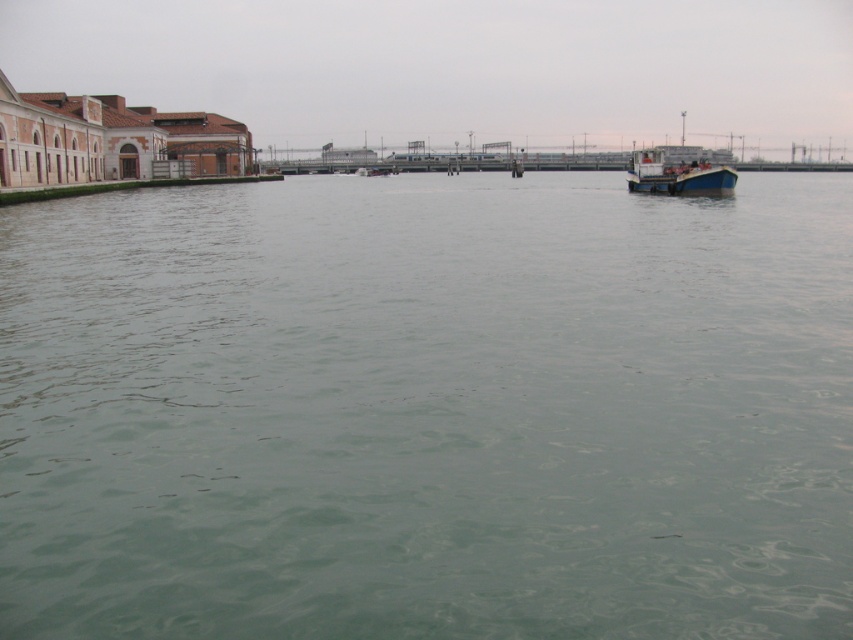
You are a tourist standing on the dock and want to take a photo of the wooden boat at right. To get the best reflection of the boat in the green water at center, where should you position yourself relative to the boat?

You should position yourself in front of the wooden boat at right, closer to the green water at center, since the green water at center is in front of the wooden boat at right and can reflect the boat better from that angle.

You are standing at the edge of the waterway and notice a point marked at coordinates (428, 410). According to the scene description, what is the color of the surface at that point?

The point at coordinates (428, 410) corresponds to green water at center, so the surface color there is green.

Based on the photo, you are standing on the wooden boat at right and want to observe the green water at center. In which direction should you look to see it?

The green water at center is below the wooden boat at right, so you should look downward to see it.